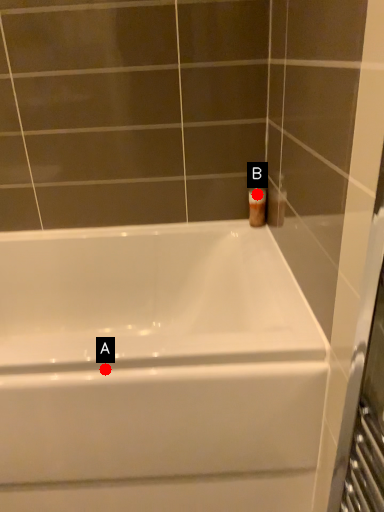
Question: Two points are circled on the image, labeled by A and B beside each circle. Which point appears farthest from the camera in this image?

Choices:
 (A) A is further
 (B) B is further

Answer: (B)